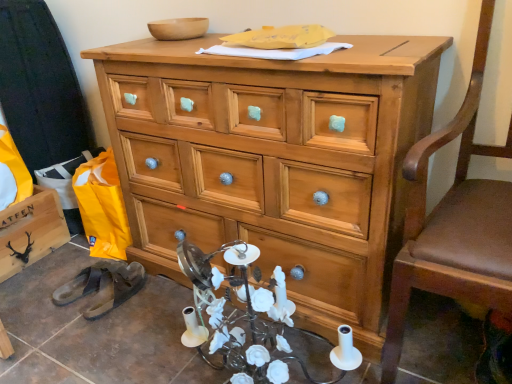
The image size is (512, 384). What are the coordinates of `vacant region in front of black rubber sandals at lower left` in the screenshot? It's located at (101, 332).